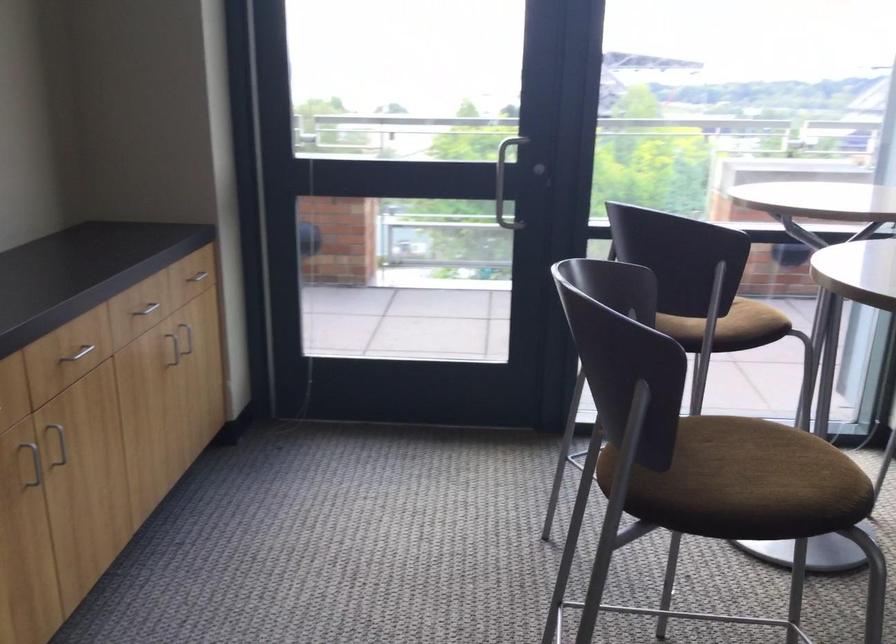
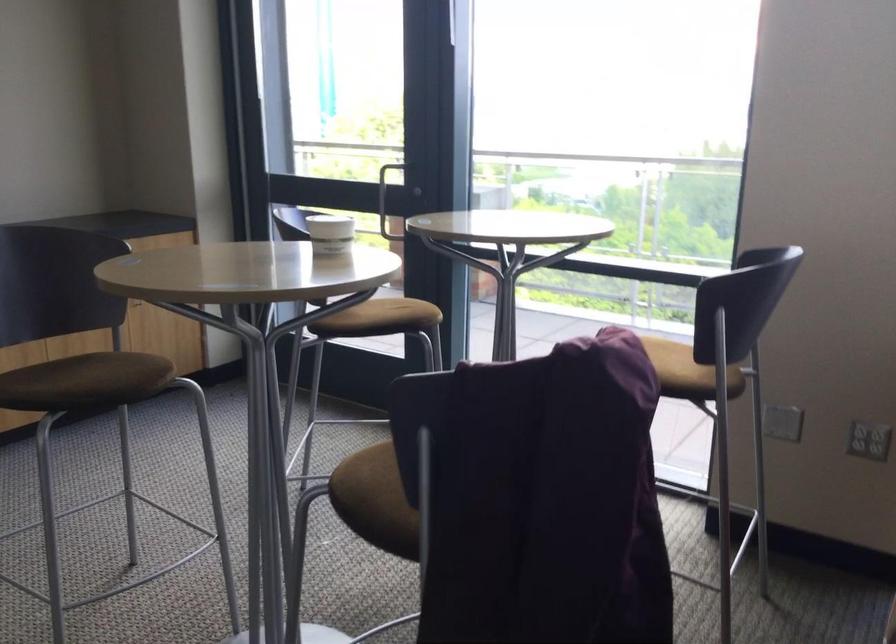
Question: I am providing you with two images of the same scene from different viewpoints. After the viewpoint changes to image2, which objects are now occluded?

Choices:
 (A) white paper cup
 (B) brown chair sitting surface
 (C) silver drawer handle
 (D) golden aluminum can

Answer: (C)